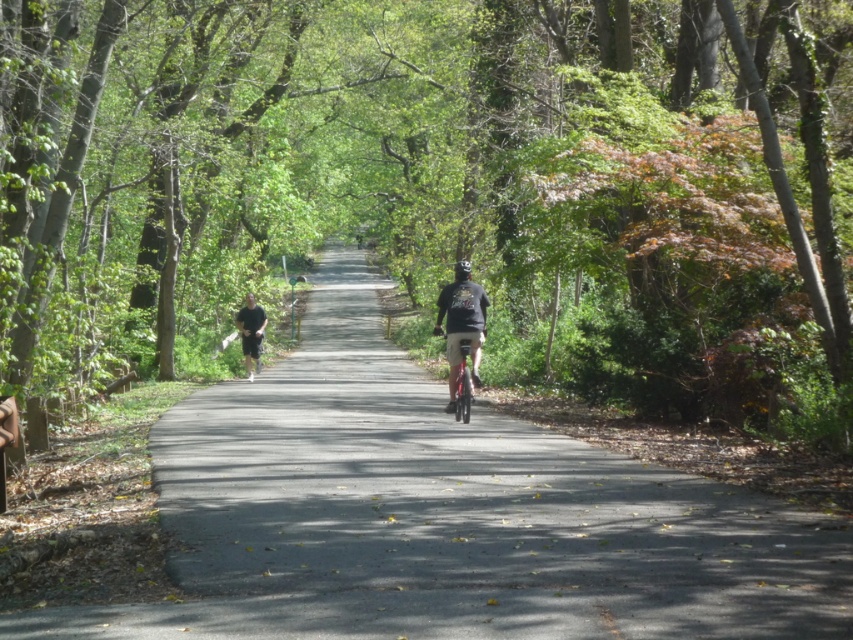
Question: Can you confirm if dark gray fabric shirt at center is bigger than black matte shorts at left?

Choices:
 (A) no
 (B) yes

Answer: (A)

Question: Does green leafy tree at center appear on the left side of shiny metallic bicycle at center?

Choices:
 (A) yes
 (B) no

Answer: (A)

Question: Among these objects, which one is nearest to the camera?

Choices:
 (A) green leafy tree at center
 (B) black matte shorts at left
 (C) dark gray fabric shirt at center
 (D) asphalt road at center

Answer: (D)

Question: Is dark gray fabric shirt at center thinner than shiny metallic bicycle at center?

Choices:
 (A) no
 (B) yes

Answer: (B)

Question: Which object appears farthest from the camera in this image?

Choices:
 (A) shiny metallic bicycle at center
 (B) black matte shorts at left

Answer: (B)

Question: Which of the following is the closest to the observer?

Choices:
 (A) green leafy tree at center
 (B) black matte shorts at left
 (C) asphalt road at center

Answer: (C)